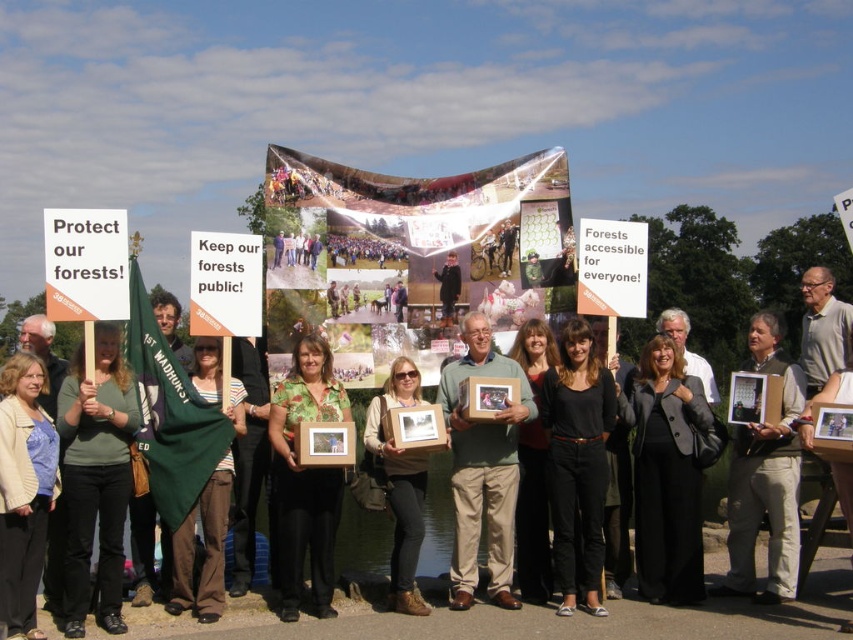
From the picture: You are a photographer taking a picture of the green fabric flag at left and the black cotton pants at center. Which object should you focus on first if you want to capture both in the same frame without moving the camera?

The green fabric flag at left is shorter than the black cotton pants at center, so you should focus on the black cotton pants at center first to ensure both objects are in focus.

You are a photographer at the forest conservation event. You need to take a photo of the black fabric coat at center and the dark gray suit at center. Which one is on the right side when facing the group?

The black fabric coat at center is positioned on the right side of dark gray suit at center, so when facing the group, the black fabric coat at center is on the right side.

You are a photographer trying to capture a clear shot of the green fabric flag at left and the black fabric coat at center. Which object should you zoom in on to avoid blurring due to their different widths?

The green fabric flag at left is thinner than the black fabric coat at center, so you should zoom in on the black fabric coat at center to avoid blurring since it is wider and requires more focus area.